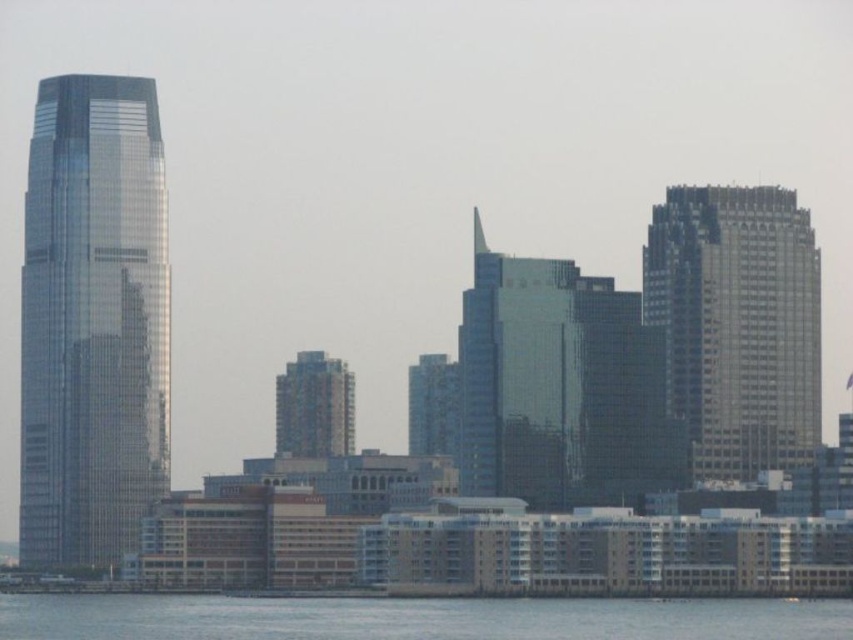
Question: Can you confirm if glassy blue skyscraper at center is smaller than blue glass building at center?

Choices:
 (A) no
 (B) yes

Answer: (A)

Question: Does shiny glass skyscraper at left have a larger size compared to glassy blue skyscraper at center?

Choices:
 (A) yes
 (B) no

Answer: (A)

Question: Which of the following is the farthest from the observer?

Choices:
 (A) shiny glass skyscraper at left
 (B) transparent water at lower center

Answer: (A)

Question: In this image, where is shiny glass skyscraper at left located relative to blue glass building at center?

Choices:
 (A) right
 (B) left

Answer: (B)

Question: Which of the following is the farthest from the observer?

Choices:
 (A) (318, 385)
 (B) (656, 413)

Answer: (B)

Question: Among these objects, which one is nearest to the camera?

Choices:
 (A) transparent water at lower center
 (B) glassy blue skyscraper at center
 (C) smokey gray glass skyscraper at right
 (D) shiny glass skyscraper at left

Answer: (B)